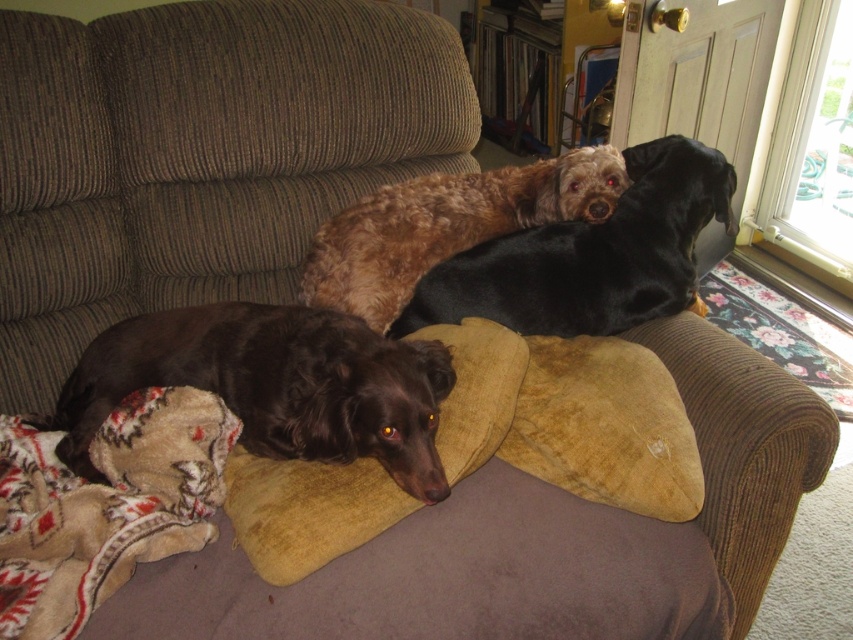
Looking at this image, can you confirm if shiny brown dog at lower left is wider than shaggy brown dog at upper center?

Incorrect, shiny brown dog at lower left's width does not surpass shaggy brown dog at upper center's.

Which is above, shiny brown dog at lower left or shaggy brown dog at upper center?

shaggy brown dog at upper center

Which is behind, point (308, 426) or point (561, 312)?

Point (561, 312)

Image resolution: width=853 pixels, height=640 pixels. I want to click on shiny brown dog at lower left, so click(273, 385).

Can you confirm if shaggy brown dog at upper center is wider than suede-like tan pillow at center?

Correct, the width of shaggy brown dog at upper center exceeds that of suede-like tan pillow at center.

Who is more forward, (x=723, y=177) or (x=654, y=404)?

Point (x=654, y=404)

Between point (511, 326) and point (543, 419), which one is positioned behind?

Positioned behind is point (511, 326).

Locate an element on the screen. shaggy brown dog at upper center is located at coordinates (590, 256).

Is fuzzy beige blanket at lower left positioned behind shaggy brown dog at upper center?

No, it is in front of shaggy brown dog at upper center.

Is point (12, 636) less distant than point (439, 269)?

Yes.

This screenshot has width=853, height=640. Identify the location of fuzzy beige blanket at lower left. (105, 506).